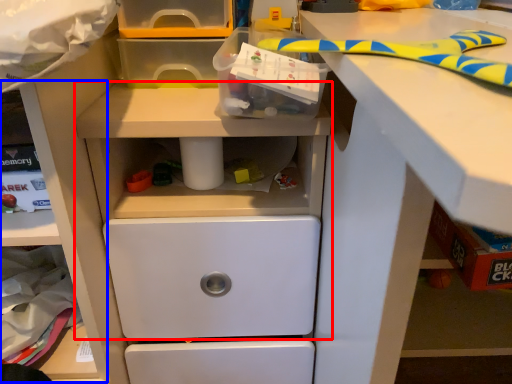
Question: Which of the following is the closest to the observer, workbench (highlighted by a red box) or shelf (highlighted by a blue box)?

Choices:
 (A) workbench
 (B) shelf

Answer: (A)